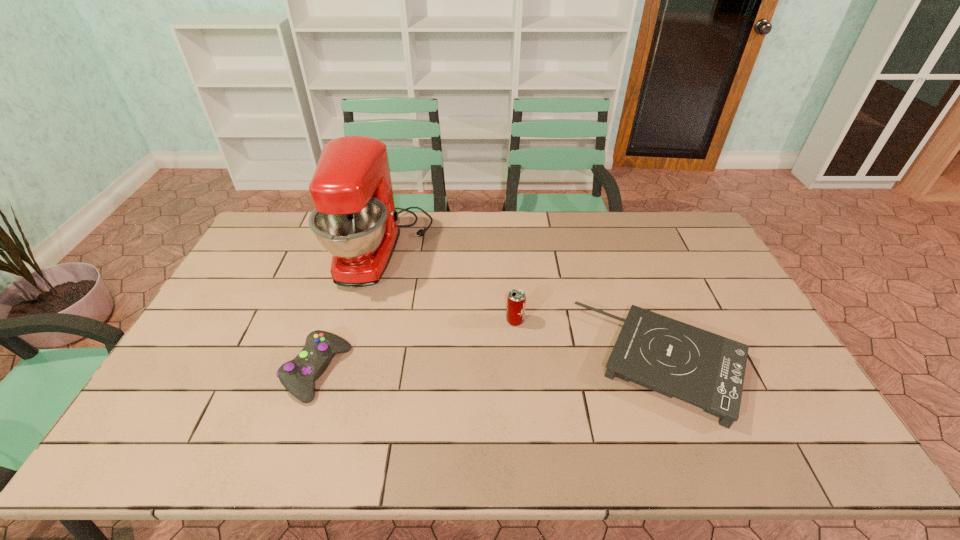
Select which object appears as the second closest to the third shortest object. Please provide its 2D coordinates. Your answer should be formatted as a tuple, i.e. [(x, y)], where the tuple contains the x and y coordinates of a point satisfying the conditions above.

[(354, 219)]

The image size is (960, 540). In order to click on vacant space that satisfies the following two spatial constraints: 1. on the front-facing side of the tallest object; 2. on the front side of the control in this screenshot , I will do `click(350, 372)`.

Image resolution: width=960 pixels, height=540 pixels. What are the coordinates of `vacant position in the image that satisfies the following two spatial constraints: 1. on the back side of the beer can; 2. on the left side of the control` in the screenshot? It's located at (334, 321).

At what (x,y) coordinates should I click in order to perform the action: click on free point that satisfies the following two spatial constraints: 1. on the back side of the hotplate; 2. on the right side of the control. Please return your answer as a coordinate pair (x, y). Looking at the image, I should click on (320, 363).

Find the location of a particular element. The height and width of the screenshot is (540, 960). vacant space that satisfies the following two spatial constraints: 1. on the front-facing side of the shortest object; 2. on the right side of the tallest object is located at coordinates (353, 363).

Find the location of a particular element. vacant area that satisfies the following two spatial constraints: 1. on the back side of the rightmost object; 2. on the front-facing side of the kitchen mixer is located at coordinates (621, 250).

Where is `free spot that satisfies the following two spatial constraints: 1. on the front side of the hotplate; 2. on the left side of the third shortest object`? This screenshot has height=540, width=960. free spot that satisfies the following two spatial constraints: 1. on the front side of the hotplate; 2. on the left side of the third shortest object is located at coordinates (518, 363).

Where is `vacant space that satisfies the following two spatial constraints: 1. on the front-facing side of the tallest object; 2. on the back side of the hotplate`? This screenshot has height=540, width=960. vacant space that satisfies the following two spatial constraints: 1. on the front-facing side of the tallest object; 2. on the back side of the hotplate is located at coordinates (353, 363).

This screenshot has width=960, height=540. Identify the location of vacant area that satisfies the following two spatial constraints: 1. on the front-facing side of the shortest object; 2. on the left side of the kitchen mixer. (353, 363).

You are a GUI agent. You are given a task and a screenshot of the screen. Output one action in this format:
    pyautogui.click(x=<x>, y=<y>)
    Task: Click on the vacant space that satisfies the following two spatial constraints: 1. on the front-facing side of the tallest object; 2. on the left side of the rightmost object
    Image resolution: width=960 pixels, height=540 pixels.
    Given the screenshot: What is the action you would take?
    pyautogui.click(x=353, y=363)